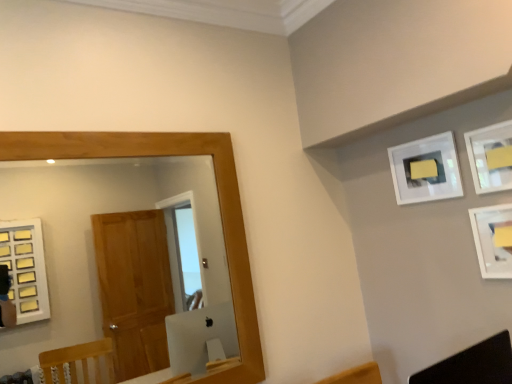
Question: Is black leather swivel chair at lower right at the left side of matte white picture frame at upper right, the 2th picture frame in the back-to-front sequence?

Choices:
 (A) yes
 (B) no

Answer: (A)

Question: Considering the relative sizes of black leather swivel chair at lower right and matte white picture frame at upper right, acting as the second picture frame starting from the front, in the image provided, is black leather swivel chair at lower right taller than matte white picture frame at upper right, acting as the second picture frame starting from the front,?

Choices:
 (A) no
 (B) yes

Answer: (A)

Question: From the image's perspective, does black leather swivel chair at lower right appear higher than matte white picture frame at upper right, acting as the second picture frame starting from the front?

Choices:
 (A) no
 (B) yes

Answer: (A)

Question: Considering the relative positions of black leather swivel chair at lower right and matte white picture frame at upper right, acting as the second picture frame starting from the front, in the image provided, is black leather swivel chair at lower right to the right of matte white picture frame at upper right, acting as the second picture frame starting from the front, from the viewer's perspective?

Choices:
 (A) yes
 (B) no

Answer: (B)

Question: Is black leather swivel chair at lower right turned away from matte white picture frame at upper right, the 2th picture frame in the back-to-front sequence?

Choices:
 (A) yes
 (B) no

Answer: (B)

Question: In terms of height, does white matte picture frame at upper right, acting as the 3th picture frame starting from the front, look taller or shorter compared to wooden-framed mirror at left?

Choices:
 (A) tall
 (B) short

Answer: (B)

Question: Is point (410, 188) closer or farther from the camera than point (20, 334)?

Choices:
 (A) closer
 (B) farther

Answer: (A)

Question: Visually, is white matte picture frame at upper right, acting as the 3th picture frame starting from the front, positioned to the left or to the right of wooden-framed mirror at left?

Choices:
 (A) right
 (B) left

Answer: (A)

Question: Is white matte picture frame at upper right, acting as the 3th picture frame starting from the front, spatially inside wooden-framed mirror at left, or outside of it?

Choices:
 (A) outside
 (B) inside

Answer: (A)

Question: From a real-world perspective, is white matte picture frame at upper right, placed as the 1th picture frame when sorted from back to front, positioned above or below matte white picture frame at upper right, acting as the second picture frame starting from the front?

Choices:
 (A) below
 (B) above

Answer: (B)

Question: Considering the positions of white matte picture frame at upper right, acting as the 3th picture frame starting from the front, and matte white picture frame at upper right, acting as the second picture frame starting from the front, in the image, is white matte picture frame at upper right, acting as the 3th picture frame starting from the front, wider or thinner than matte white picture frame at upper right, acting as the second picture frame starting from the front,?

Choices:
 (A) wide
 (B) thin

Answer: (B)

Question: Relative to matte white picture frame at upper right, acting as the second picture frame starting from the front, is white matte picture frame at upper right, placed as the 1th picture frame when sorted from back to front, in front or behind?

Choices:
 (A) front
 (B) behind

Answer: (B)

Question: Is white matte picture frame at upper right, placed as the 1th picture frame when sorted from back to front, situated inside matte white picture frame at upper right, the 2th picture frame in the back-to-front sequence, or outside?

Choices:
 (A) outside
 (B) inside

Answer: (A)

Question: Considering their positions, is matte white picture frame at upper right, acting as the second picture frame starting from the front, located in front of or behind wooden-framed mirror at left?

Choices:
 (A) behind
 (B) front

Answer: (A)

Question: Is matte white picture frame at upper right, the 2th picture frame in the back-to-front sequence, taller or shorter than wooden-framed mirror at left?

Choices:
 (A) short
 (B) tall

Answer: (A)